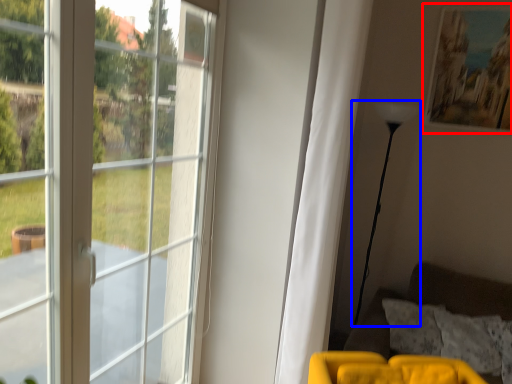
Question: Which point is closer to the camera, picture frame (highlighted by a red box) or lamp (highlighted by a blue box)?

Choices:
 (A) picture frame
 (B) lamp

Answer: (B)